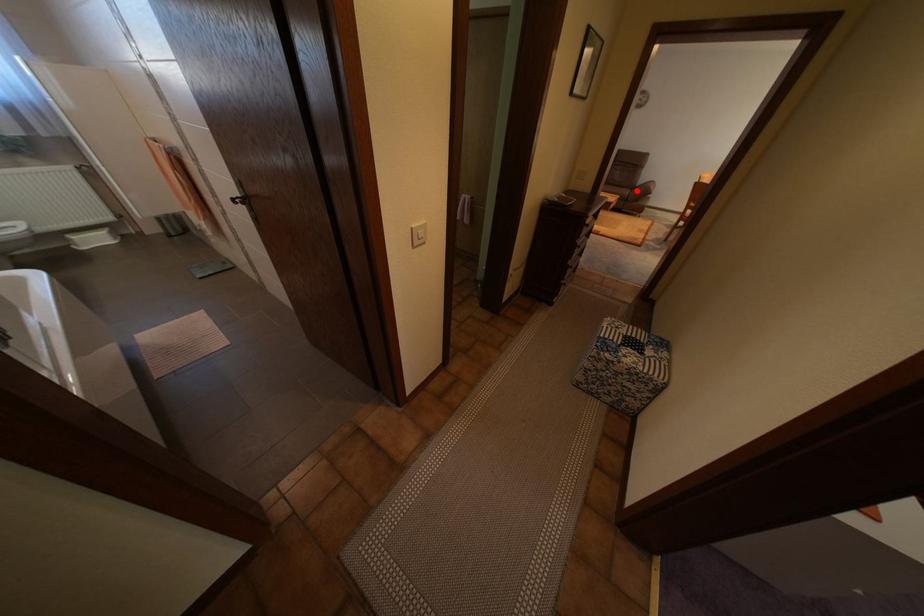
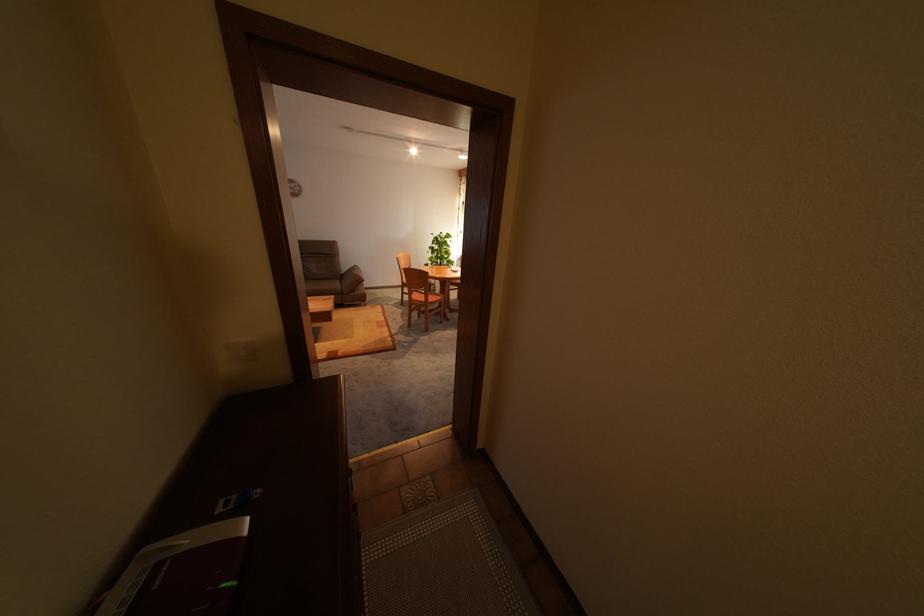
The point at the highlighted location is marked in the first image. Where is the corresponding point in the second image?

(347, 284)